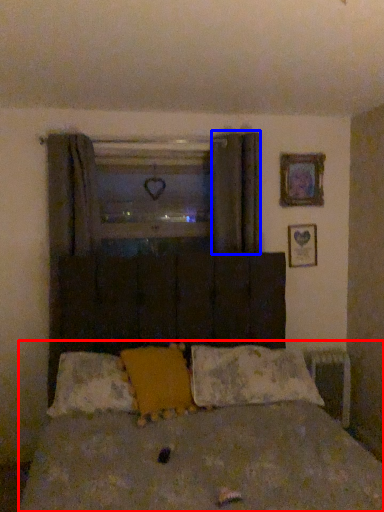
Question: Which object is closer to the camera taking this photo, bed (highlighted by a red box) or curtain (highlighted by a blue box)?

Choices:
 (A) bed
 (B) curtain

Answer: (A)